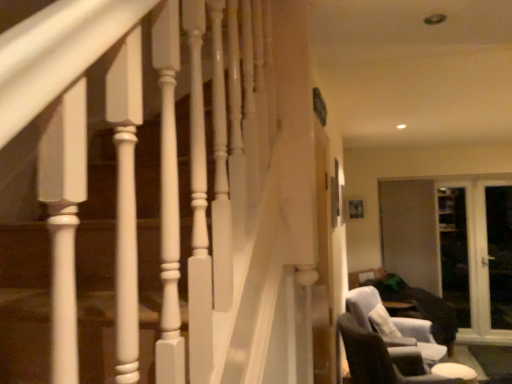
Question: Are dark gray fabric chair at lower right and transparent glass screen door at right, acting as the 2th screen door starting from the left, located far from each other?

Choices:
 (A) no
 (B) yes

Answer: (B)

Question: Is transparent glass screen door at right, which appears as the third screen door when viewed from the right, at the back of dark gray fabric chair at lower right?

Choices:
 (A) yes
 (B) no

Answer: (B)

Question: From the image's perspective, is dark gray fabric chair at lower right located beneath transparent glass screen door at right, which appears as the third screen door when viewed from the right?

Choices:
 (A) no
 (B) yes

Answer: (B)

Question: Is dark gray fabric chair at lower right at the right side of transparent glass screen door at right, acting as the 2th screen door starting from the left?

Choices:
 (A) no
 (B) yes

Answer: (A)

Question: Does dark gray fabric chair at lower right appear on the left side of transparent glass screen door at right, which appears as the third screen door when viewed from the right?

Choices:
 (A) no
 (B) yes

Answer: (B)

Question: From the image's perspective, is transparent glass screen door at right, the 2th screen door in the right-to-left sequence, above or below dark gray fabric swivel chair at lower right?

Choices:
 (A) above
 (B) below

Answer: (A)

Question: In terms of width, does transparent glass screen door at right, the 2th screen door in the right-to-left sequence, look wider or thinner when compared to dark gray fabric swivel chair at lower right?

Choices:
 (A) wide
 (B) thin

Answer: (B)

Question: Is transparent glass screen door at right, the 3th screen door viewed from the left, in front of or behind dark gray fabric swivel chair at lower right in the image?

Choices:
 (A) front
 (B) behind

Answer: (B)

Question: Would you say transparent glass screen door at right, the 2th screen door in the right-to-left sequence, is inside or outside dark gray fabric swivel chair at lower right?

Choices:
 (A) outside
 (B) inside

Answer: (A)

Question: Would you say transparent glass screen door at right, placed as the fourth screen door when sorted from right to left, is inside or outside dark gray fabric swivel chair at lower right?

Choices:
 (A) inside
 (B) outside

Answer: (B)

Question: Is point 414,183 closer or farther from the camera than point 433,347?

Choices:
 (A) farther
 (B) closer

Answer: (A)

Question: From the image's perspective, is transparent glass screen door at right, the first screen door when ordered from left to right, above or below dark gray fabric swivel chair at lower right?

Choices:
 (A) above
 (B) below

Answer: (A)

Question: In terms of size, does transparent glass screen door at right, placed as the fourth screen door when sorted from right to left, appear bigger or smaller than dark gray fabric swivel chair at lower right?

Choices:
 (A) small
 (B) big

Answer: (A)

Question: In terms of width, does white glossy door at right, placed as the first screen door when sorted from right to left, look wider or thinner when compared to transparent glass screen door at right, the 3th screen door viewed from the left?

Choices:
 (A) wide
 (B) thin

Answer: (A)

Question: Does point (504, 253) appear closer or farther from the camera than point (446, 201)?

Choices:
 (A) farther
 (B) closer

Answer: (B)